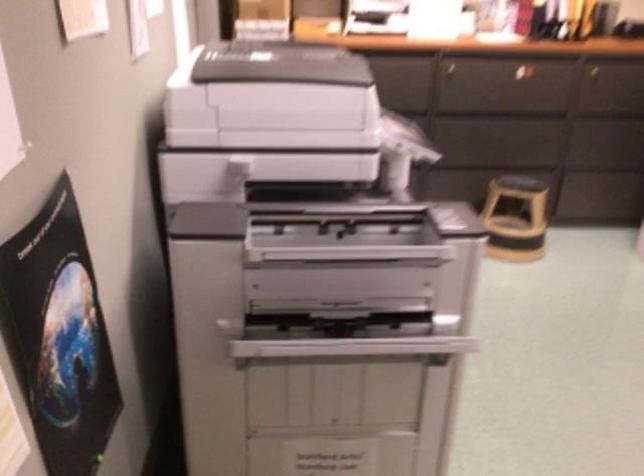
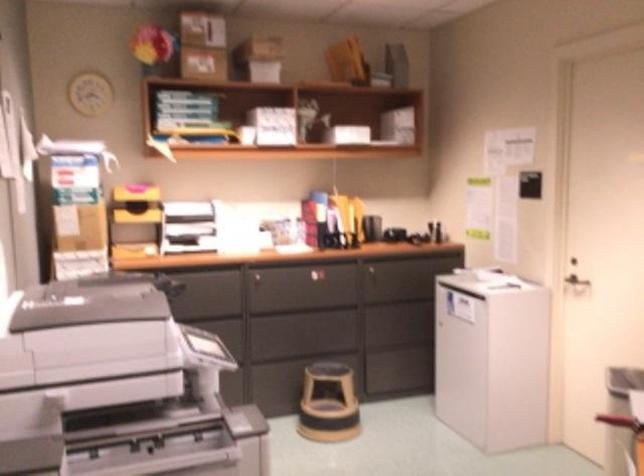
From the picture: Based on the continuous images, in which direction is the camera rotating?

The camera rotated toward right-up.